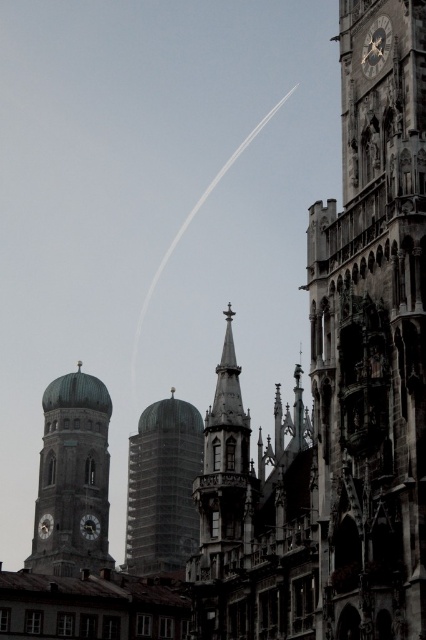
You are standing in the historic cityscape and want to locate the green copper dome at left. According to the coordinates provided, where should you look?

The green copper dome at left is located at point (72, 476).